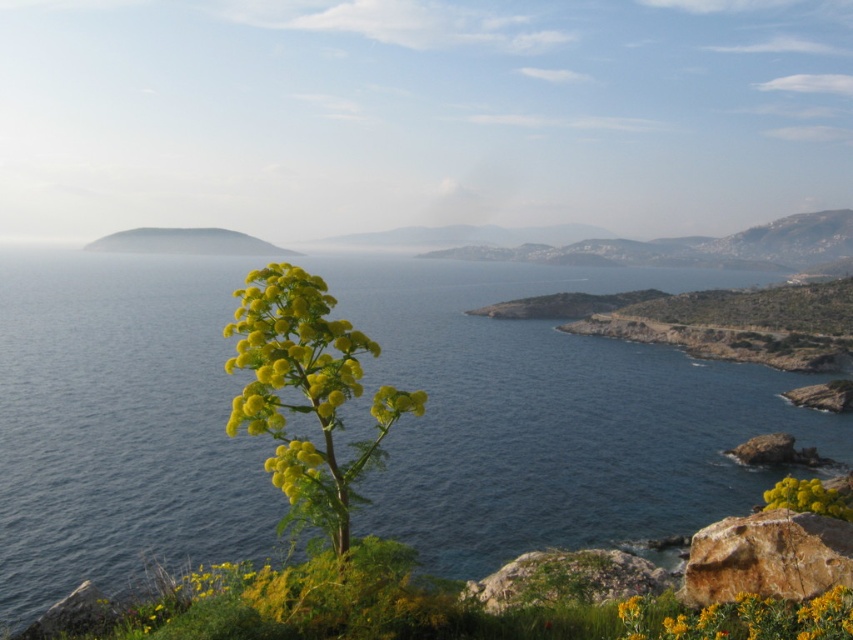
Is the position of blue water at center less distant than that of green matte hillside at upper center?

That is True.

Is point (230, 528) positioned before point (212, 227)?

Yes, point (230, 528) is in front of point (212, 227).

You are a GUI agent. You are given a task and a screenshot of the screen. Output one action in this format:
    pyautogui.click(x=<x>, y=<y>)
    Task: Click on the blue water at center
    The width and height of the screenshot is (853, 640).
    Given the screenshot: What is the action you would take?
    pyautogui.click(x=550, y=413)

Who is positioned more to the left, blue water at center or brown rough rock at lower right?

blue water at center is more to the left.

Based on the photo, is blue water at center wider than brown rough rock at lower right?

Yes.

What do you see at coordinates (550, 413) in the screenshot? I see `blue water at center` at bounding box center [550, 413].

Identify the location of blue water at center. (550, 413).

Is point (252, 429) positioned in front of point (821, 589)?

Yes, it is in front of point (821, 589).

Between point (328, 353) and point (833, 561), which one is positioned behind?

The point (833, 561) is more distant.

The image size is (853, 640). Describe the element at coordinates (303, 376) in the screenshot. I see `yellow fluffy plant at center` at that location.

What are the coordinates of `yellow fluffy plant at center` in the screenshot? It's located at (303, 376).